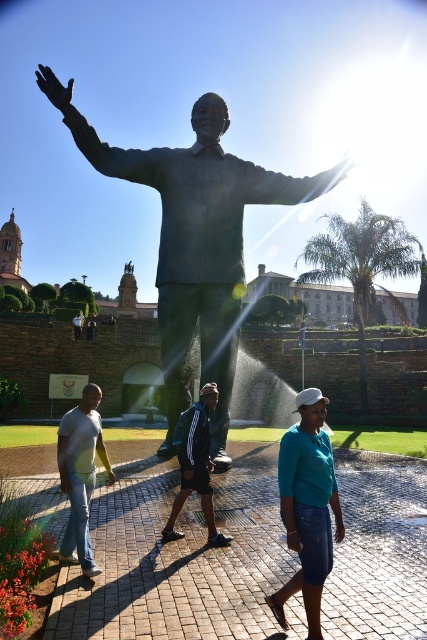
Can you confirm if bronze statue at center is bigger than light gray t-shirt at center?

Indeed, bronze statue at center has a larger size compared to light gray t-shirt at center.

Find the location of a particular element. This screenshot has height=640, width=427. bronze statue at center is located at coordinates (195, 241).

The width and height of the screenshot is (427, 640). What do you see at coordinates (81, 474) in the screenshot?
I see `light gray t-shirt at center` at bounding box center [81, 474].

Is point (69, 552) more distant than point (178, 532)?

No, (69, 552) is in front of (178, 532).

Where is `light gray t-shirt at center`? The height and width of the screenshot is (640, 427). light gray t-shirt at center is located at coordinates (81, 474).

Which is above, bronze statue at center or teal matte shirt at center?

Positioned higher is bronze statue at center.

Which is in front, point (219, 352) or point (313, 412)?

Point (313, 412) is more forward.

Is point (186, 276) more distant than point (294, 525)?

Yes, point (186, 276) is farther from viewer.

The height and width of the screenshot is (640, 427). What are the coordinates of `bronze statue at center` in the screenshot? It's located at (195, 241).